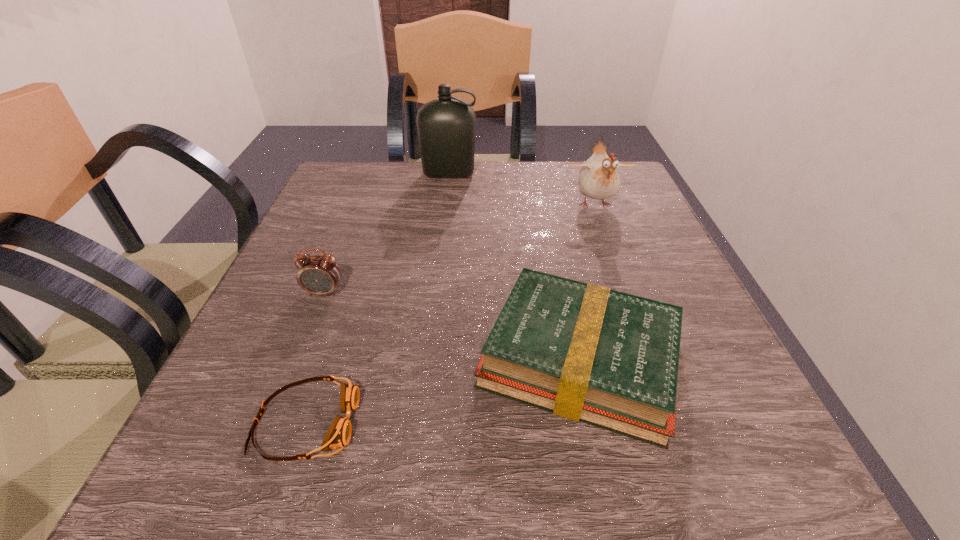
What are the coordinates of `object present at the near left corner` in the screenshot? It's located at (338, 435).

At what (x,y) coordinates should I click in order to perform the action: click on object that is at the far right corner. Please return your answer as a coordinate pair (x, y). Looking at the image, I should click on (599, 179).

You are a GUI agent. You are given a task and a screenshot of the screen. Output one action in this format:
    pyautogui.click(x=<x>, y=<y>)
    Task: Click on the object present at the near right corner
    This screenshot has width=960, height=540.
    Given the screenshot: What is the action you would take?
    pyautogui.click(x=585, y=352)

Where is `vacant space at the far edge of the desktop`? This screenshot has width=960, height=540. vacant space at the far edge of the desktop is located at coordinates (494, 173).

Locate an element on the screen. This screenshot has width=960, height=540. vacant space at the near edge of the desktop is located at coordinates (633, 465).

Locate an element on the screen. This screenshot has width=960, height=540. vacant position at the left edge of the desktop is located at coordinates (323, 337).

Where is `vacant space at the right edge of the desktop`? vacant space at the right edge of the desktop is located at coordinates (640, 295).

In the image, there is a desktop. In order to click on blank space at the near left corner in this screenshot , I will do `click(258, 456)`.

At what (x,y) coordinates should I click in order to perform the action: click on vacant position at the near right corner of the desktop. Please return your answer as a coordinate pair (x, y). The image size is (960, 540). Looking at the image, I should click on (754, 442).

Locate an element on the screen. Image resolution: width=960 pixels, height=540 pixels. vacant space that's between the goggles and the alarm clock is located at coordinates point(315,357).